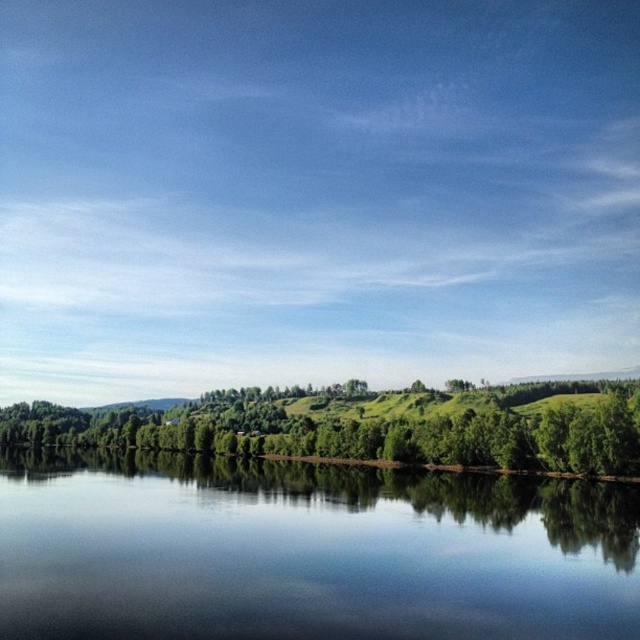
Question: Is transparent water at center bigger than green leafy trees at center?

Choices:
 (A) no
 (B) yes

Answer: (A)

Question: Among these points, which one is nearest to the camera?

Choices:
 (A) (426, 579)
 (B) (384, 416)

Answer: (A)

Question: Which of the following is the closest to the observer?

Choices:
 (A) transparent water at center
 (B) green leafy trees at center

Answer: (A)

Question: Does transparent water at center have a smaller size compared to green leafy trees at center?

Choices:
 (A) yes
 (B) no

Answer: (A)

Question: Which of the following is the farthest from the observer?

Choices:
 (A) green leafy trees at center
 (B) transparent water at center

Answer: (A)

Question: Does transparent water at center appear on the right side of green leafy trees at center?

Choices:
 (A) yes
 (B) no

Answer: (A)